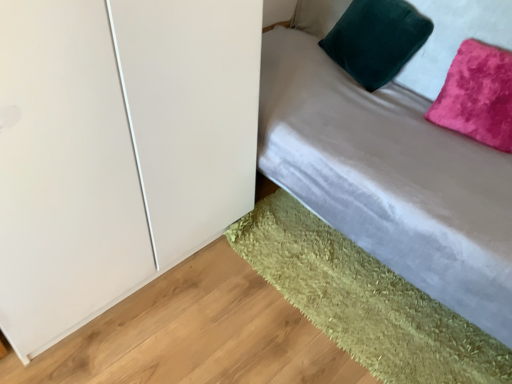
Question: From a real-world perspective, is velvet green pillow at upper right, the 2th pillow when ordered from right to left, on top of velvet gray bed at upper right?

Choices:
 (A) yes
 (B) no

Answer: (A)

Question: From the image's perspective, is velvet green pillow at upper right, the 2th pillow when ordered from right to left, located beneath velvet gray bed at upper right?

Choices:
 (A) no
 (B) yes

Answer: (A)

Question: Can you confirm if velvet green pillow at upper right, the 1th pillow viewed from the left, is smaller than velvet gray bed at upper right?

Choices:
 (A) yes
 (B) no

Answer: (A)

Question: Is velvet green pillow at upper right, the 2th pillow when ordered from right to left, positioned before velvet gray bed at upper right?

Choices:
 (A) yes
 (B) no

Answer: (B)

Question: Does velvet green pillow at upper right, the 2th pillow when ordered from right to left, have a lesser width compared to velvet gray bed at upper right?

Choices:
 (A) yes
 (B) no

Answer: (A)

Question: From a real-world perspective, is velvet green pillow at upper right, the 1th pillow viewed from the left, located beneath velvet gray bed at upper right?

Choices:
 (A) yes
 (B) no

Answer: (B)

Question: Can you confirm if green shaggy rug at lower right is thinner than velvet green pillow at upper right, the 1th pillow viewed from the left?

Choices:
 (A) no
 (B) yes

Answer: (A)

Question: Can you confirm if green shaggy rug at lower right is taller than velvet green pillow at upper right, the 1th pillow viewed from the left?

Choices:
 (A) yes
 (B) no

Answer: (B)

Question: From the image's perspective, is green shaggy rug at lower right over velvet green pillow at upper right, the 2th pillow when ordered from right to left?

Choices:
 (A) no
 (B) yes

Answer: (A)

Question: From a real-world perspective, is green shaggy rug at lower right positioned over velvet green pillow at upper right, the 2th pillow when ordered from right to left, based on gravity?

Choices:
 (A) yes
 (B) no

Answer: (B)

Question: Could you tell me if green shaggy rug at lower right is turned towards velvet green pillow at upper right, the 1th pillow viewed from the left?

Choices:
 (A) no
 (B) yes

Answer: (A)

Question: Is green shaggy rug at lower right in front of velvet green pillow at upper right, the 2th pillow when ordered from right to left?

Choices:
 (A) yes
 (B) no

Answer: (A)

Question: Is velvet gray bed at upper right aimed at pink velvet pillow at upper right, positioned as the 2th pillow in left-to-right order?

Choices:
 (A) yes
 (B) no

Answer: (A)